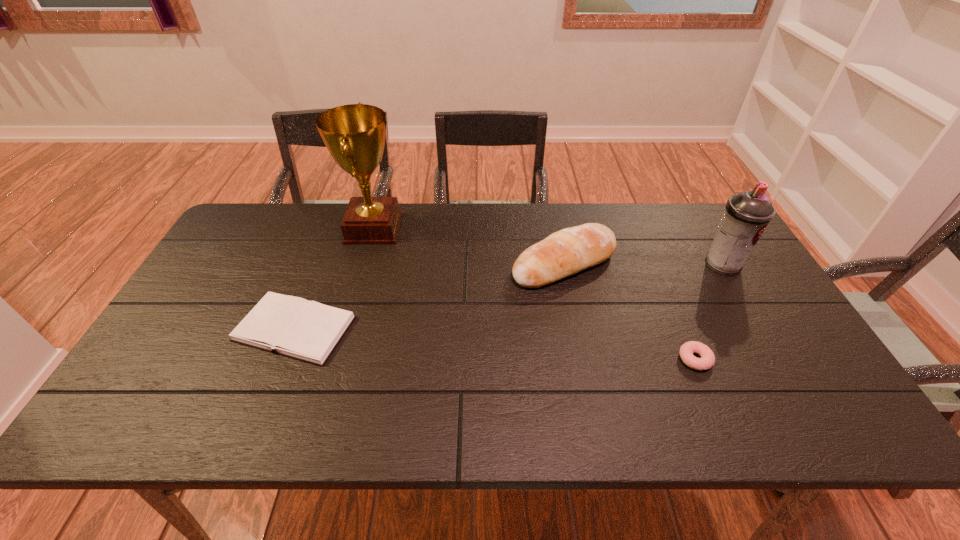
Find the location of a particular element. object that is the second closest to the tallest object is located at coordinates (563, 253).

Where is `vacant space that satisfies the following two spatial constraints: 1. on the plaque of the tallest object; 2. on the front side of the hardback book`? This screenshot has height=540, width=960. vacant space that satisfies the following two spatial constraints: 1. on the plaque of the tallest object; 2. on the front side of the hardback book is located at coordinates pyautogui.click(x=346, y=329).

Find the location of a particular element. vacant point that satisfies the following two spatial constraints: 1. on the plaque of the award; 2. on the right side of the second tallest object is located at coordinates (364, 265).

Identify the location of vacant area in the image that satisfies the following two spatial constraints: 1. on the plaque of the tallest object; 2. on the right side of the fourth shortest object. The width and height of the screenshot is (960, 540). (364, 265).

Where is `free space that satisfies the following two spatial constraints: 1. on the plaque of the second tallest object; 2. on the right side of the tallest object`? The image size is (960, 540). free space that satisfies the following two spatial constraints: 1. on the plaque of the second tallest object; 2. on the right side of the tallest object is located at coordinates (364, 265).

This screenshot has height=540, width=960. Identify the location of blank area in the image that satisfies the following two spatial constraints: 1. on the plaque of the award; 2. on the front side of the hardback book. (346, 329).

You are a GUI agent. You are given a task and a screenshot of the screen. Output one action in this format:
    pyautogui.click(x=<x>, y=<y>)
    Task: Click on the free space that satisfies the following two spatial constraints: 1. on the back side of the aerosol can; 2. on the right side of the doughnut
    
    Given the screenshot: What is the action you would take?
    pyautogui.click(x=655, y=265)